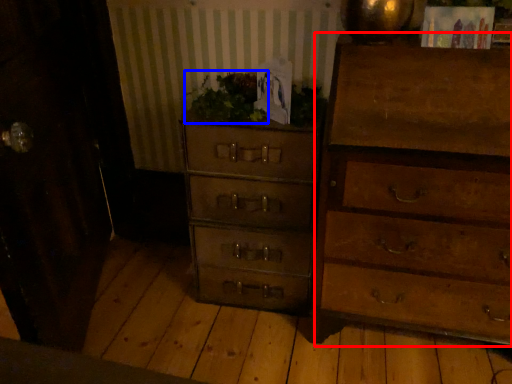
Question: Which object appears closest to the camera in this image, chest of drawers (highlighted by a red box) or houseplant (highlighted by a blue box)?

Choices:
 (A) chest of drawers
 (B) houseplant

Answer: (A)